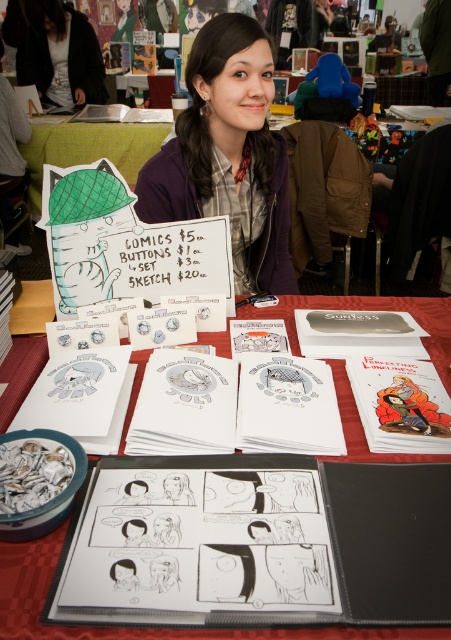
Question: Which object appears closest to the camera in this image?

Choices:
 (A) matte purple sweater at center
 (B) matte black jacket at upper left
 (C) white paper comic book at center

Answer: (C)

Question: Can you confirm if matte purple sweater at center is positioned above matte black jacket at upper left?

Choices:
 (A) yes
 (B) no

Answer: (B)

Question: Among these objects, which one is farthest from the camera?

Choices:
 (A) white paper comic book at center
 (B) matte black jacket at upper left

Answer: (B)

Question: Which of the following is the closest to the observer?

Choices:
 (A) matte purple sweater at center
 (B) black ink drawing of a person at center

Answer: (B)

Question: Observing the image, what is the correct spatial positioning of white paper comic book at center in reference to black paper at center?

Choices:
 (A) right
 (B) left

Answer: (A)

Question: Is white paper comic book at center positioned in front of matte black jacket at upper left?

Choices:
 (A) no
 (B) yes

Answer: (B)